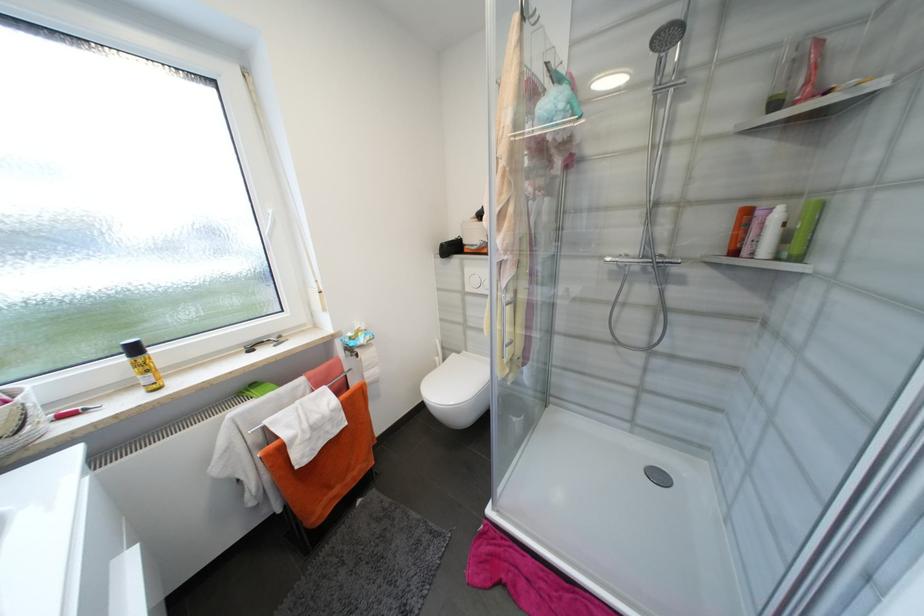
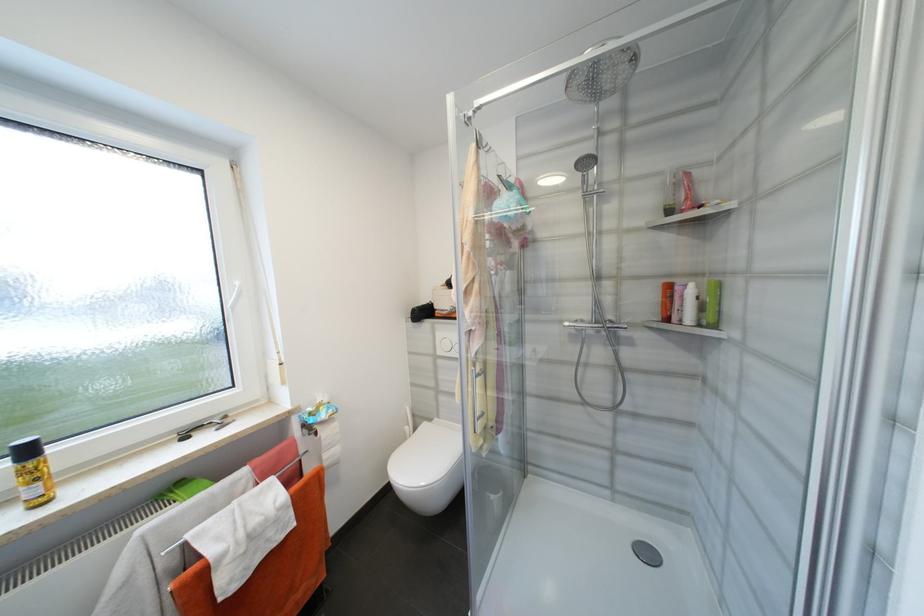
Locate, in the second image, the point that corresponds to the point at 655,91 in the first image.

(586, 195)